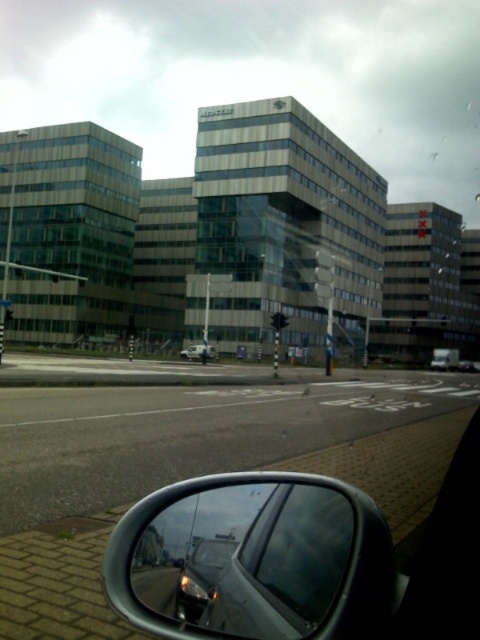
Is point (374, 573) closer to viewer compared to point (291, 496)?

Yes, point (374, 573) is closer to viewer.

Is shiny silver mirror at lower right wider than transparent glass car window at lower center?

Correct, the width of shiny silver mirror at lower right exceeds that of transparent glass car window at lower center.

Describe the element at coordinates (254, 557) in the screenshot. Image resolution: width=480 pixels, height=640 pixels. I see `shiny silver mirror at lower right` at that location.

Where is `shiny silver mirror at lower right`? Image resolution: width=480 pixels, height=640 pixels. shiny silver mirror at lower right is located at coordinates (254, 557).

The image size is (480, 640). Describe the element at coordinates (308, 548) in the screenshot. I see `transparent glass car window at lower center` at that location.

Is transparent glass car window at lower center wider than metallic silver car at center?

No.

Identify the location of transparent glass car window at lower center. This screenshot has width=480, height=640. (308, 548).

Between shiny silver mirror at lower right and metallic silver car at center, which one appears on the left side from the viewer's perspective?

Positioned to the left is metallic silver car at center.

Does shiny silver mirror at lower right come behind metallic silver car at center?

No, it is in front of metallic silver car at center.

Describe the element at coordinates (254, 557) in the screenshot. The height and width of the screenshot is (640, 480). I see `shiny silver mirror at lower right` at that location.

Locate an element on the screen. The height and width of the screenshot is (640, 480). shiny silver mirror at lower right is located at coordinates (254, 557).